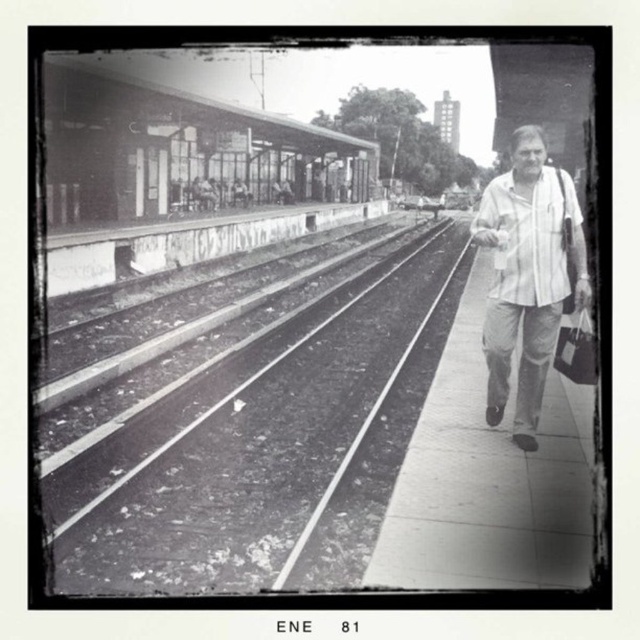
Which of these two, smooth concrete tracks at center or white cotton shirt at right, stands shorter?

With less height is smooth concrete tracks at center.

Does smooth concrete tracks at center appear on the right side of white cotton shirt at right?

No, smooth concrete tracks at center is not to the right of white cotton shirt at right.

Who is more distant from viewer, (122,580) or (486,408)?

The point (486,408) is behind.

The width and height of the screenshot is (640, 640). Identify the location of smooth concrete tracks at center. (257, 442).